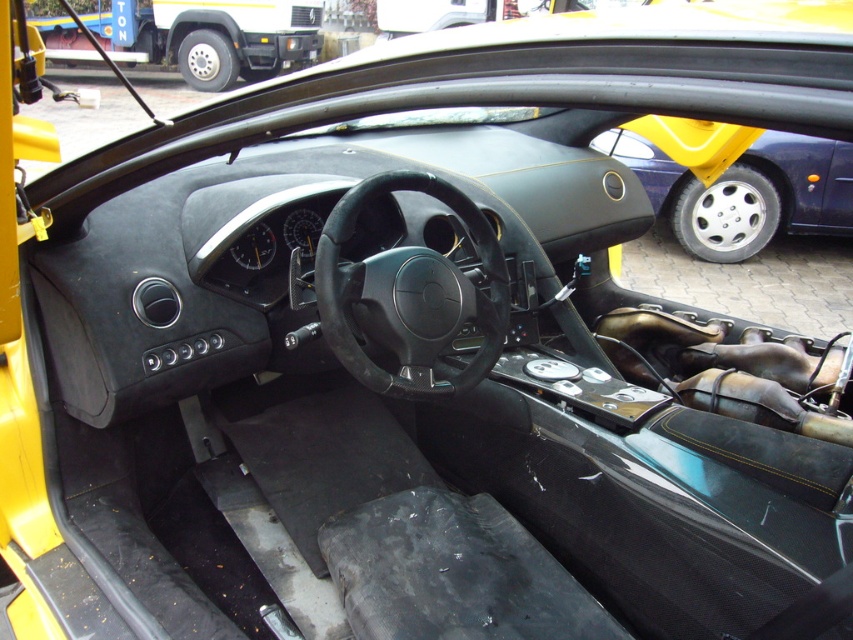
From the picture: You are sitting in the driver seat of the sports car and need to adjust the climate control. The climate control buttons are located on the metallic silver wheel at right. Can you easily reach them while keeping both hands on the black leather steering wheel at center?

The black leather steering wheel at center is below the metallic silver wheel at right, so the metallic silver wheel at right is positioned higher. Since the climate control buttons are on the metallic silver wheel at right, you might need to move one hand from the black leather steering wheel at center to reach them, as they are not directly on the steering wheel you are holding.

You are a mechanic working on a sports car and need to reach the metallic silver wheel at right while standing next to the black leather steering wheel at center. Given that your arm can extend 3 feet, can you comfortably reach it?

The distance between the black leather steering wheel at center and the metallic silver wheel at right is 11.20 feet, which is much greater than your arm extension of 3 feet. Therefore, you cannot comfortably reach the metallic silver wheel at right from the black leather steering wheel at center.

You are sitting in the driver seat of the sports car and want to reach a control located at point (x=352, y=262). If your arm can reach up to 5 feet, can you comfortably reach it?

The distance between you and point (x=352, y=262) is 5.72 feet, which is beyond your arm reach of 5 feet. Therefore, you cannot comfortably reach it.